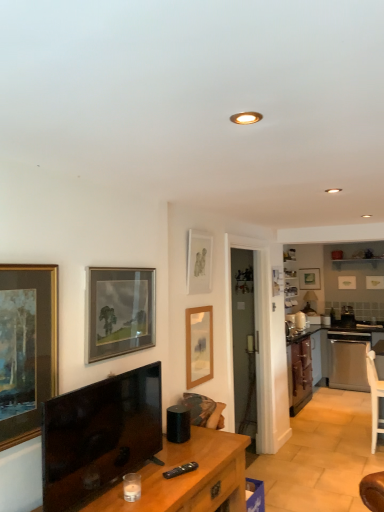
Question: Can you confirm if wooden desk at center is positioned to the right of matte gold picture frame at upper right, positioned as the 1th picture frame in right-to-left order?

Choices:
 (A) no
 (B) yes

Answer: (A)

Question: Does wooden desk at center have a smaller size compared to matte gold picture frame at upper right, placed as the 7th picture frame when sorted from left to right?

Choices:
 (A) no
 (B) yes

Answer: (A)

Question: Are wooden desk at center and matte gold picture frame at upper right, positioned as the 1th picture frame in right-to-left order, making contact?

Choices:
 (A) no
 (B) yes

Answer: (A)

Question: Does wooden desk at center have a lesser width compared to matte gold picture frame at upper right, which is the third picture frame in back-to-front order?

Choices:
 (A) yes
 (B) no

Answer: (B)

Question: Does wooden desk at center come in front of matte gold picture frame at upper right, acting as the fifth picture frame starting from the front?

Choices:
 (A) no
 (B) yes

Answer: (B)

Question: From their relative heights in the image, would you say wooden picture frame at left, which is the first picture frame in front-to-back order, is taller or shorter than matte wooden picture frame at upper right, the fifth picture frame in the left-to-right sequence?

Choices:
 (A) short
 (B) tall

Answer: (B)

Question: Considering the positions of wooden picture frame at left, which is the first picture frame in front-to-back order, and matte wooden picture frame at upper right, the fifth picture frame in the left-to-right sequence, in the image, is wooden picture frame at left, which is the first picture frame in front-to-back order, wider or thinner than matte wooden picture frame at upper right, the fifth picture frame in the left-to-right sequence,?

Choices:
 (A) thin
 (B) wide

Answer: (A)

Question: Considering their positions, is wooden picture frame at left, marked as the seventh picture frame in a back-to-front arrangement, located in front of or behind matte wooden picture frame at upper right, the 7th picture frame in the front-to-back sequence?

Choices:
 (A) front
 (B) behind

Answer: (A)

Question: In terms of size, does wooden picture frame at left, which ranks as the 7th picture frame in right-to-left order, appear bigger or smaller than matte wooden picture frame at upper right, the 7th picture frame in the front-to-back sequence?

Choices:
 (A) big
 (B) small

Answer: (A)

Question: Considering the positions of white glossy shelf at upper right and wooden desk at center in the image, is white glossy shelf at upper right taller or shorter than wooden desk at center?

Choices:
 (A) short
 (B) tall

Answer: (A)

Question: From a real-world perspective, is white glossy shelf at upper right above or below wooden desk at center?

Choices:
 (A) above
 (B) below

Answer: (A)

Question: Is white glossy shelf at upper right in front of or behind wooden desk at center in the image?

Choices:
 (A) behind
 (B) front

Answer: (A)

Question: Is point (336, 268) positioned closer to the camera than point (190, 488)?

Choices:
 (A) closer
 (B) farther

Answer: (B)

Question: Looking at the image, does wooden picture frame at left, which is the first picture frame in front-to-back order, seem bigger or smaller compared to wooden picture frame at center, marked as the third picture frame in a left-to-right arrangement?

Choices:
 (A) big
 (B) small

Answer: (B)

Question: Is wooden picture frame at left, marked as the seventh picture frame in a back-to-front arrangement, in front of or behind wooden picture frame at center, marked as the third picture frame in a left-to-right arrangement, in the image?

Choices:
 (A) behind
 (B) front

Answer: (B)